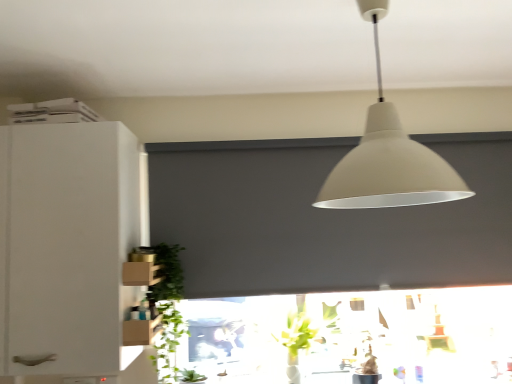
Question: From the image's perspective, is white matte cabinet at left on top of matte gray window screen at center?

Choices:
 (A) no
 (B) yes

Answer: (A)

Question: From a real-world perspective, is white matte cabinet at left physically below matte gray window screen at center?

Choices:
 (A) no
 (B) yes

Answer: (B)

Question: Does white matte cabinet at left have a greater width compared to matte gray window screen at center?

Choices:
 (A) no
 (B) yes

Answer: (B)

Question: Would you say white matte cabinet at left is a long distance from matte gray window screen at center?

Choices:
 (A) no
 (B) yes

Answer: (A)

Question: Is white matte cabinet at left surrounding matte gray window screen at center?

Choices:
 (A) yes
 (B) no

Answer: (B)

Question: Is white matte cabinet at left touching matte gray window screen at center?

Choices:
 (A) no
 (B) yes

Answer: (A)

Question: Is matte gray window screen at center turned away from matte white lampshade at upper center?

Choices:
 (A) no
 (B) yes

Answer: (A)

Question: Considering the relative sizes of matte gray window screen at center and matte white lampshade at upper center in the image provided, is matte gray window screen at center bigger than matte white lampshade at upper center?

Choices:
 (A) yes
 (B) no

Answer: (A)

Question: From the image's perspective, is matte gray window screen at center beneath matte white lampshade at upper center?

Choices:
 (A) no
 (B) yes

Answer: (B)

Question: Could matte white lampshade at upper center be considered to be inside matte gray window screen at center?

Choices:
 (A) no
 (B) yes

Answer: (A)

Question: Is the position of matte gray window screen at center less distant than that of matte white lampshade at upper center?

Choices:
 (A) yes
 (B) no

Answer: (B)

Question: Considering the relative sizes of matte gray window screen at center and matte white lampshade at upper center in the image provided, is matte gray window screen at center taller than matte white lampshade at upper center?

Choices:
 (A) no
 (B) yes

Answer: (B)

Question: Is white matte cabinet at left closer to camera compared to green leafy plant at lower left?

Choices:
 (A) yes
 (B) no

Answer: (A)